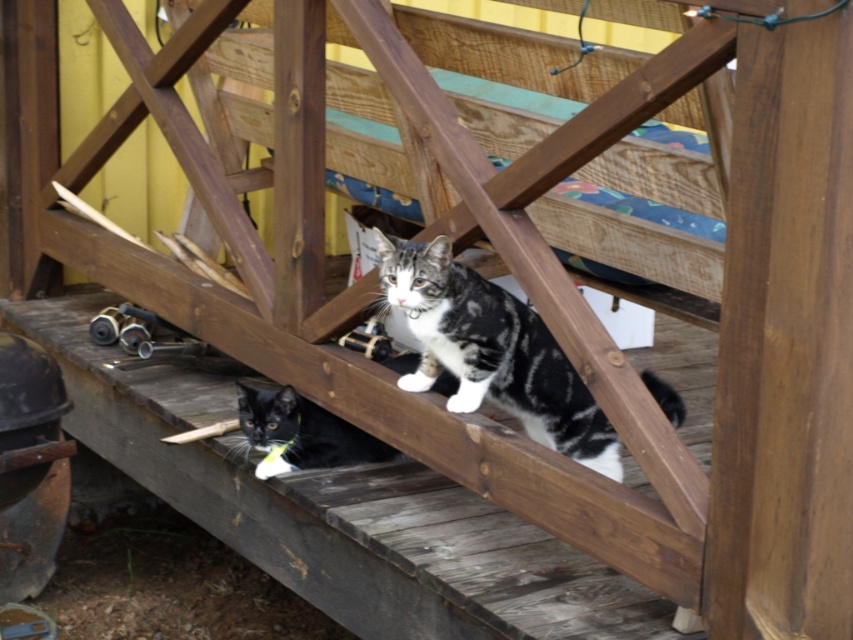
Question: From the image, what is the correct spatial relationship of tabby fur cat at center in relation to black fur cat at lower left?

Choices:
 (A) below
 (B) above

Answer: (B)

Question: Can you confirm if tabby fur cat at center is smaller than black fur cat at lower left?

Choices:
 (A) yes
 (B) no

Answer: (B)

Question: Which point is farther from the camera taking this photo?

Choices:
 (A) (300, 445)
 (B) (579, 445)

Answer: (A)

Question: Is tabby fur cat at center wider than black fur cat at lower left?

Choices:
 (A) no
 (B) yes

Answer: (B)